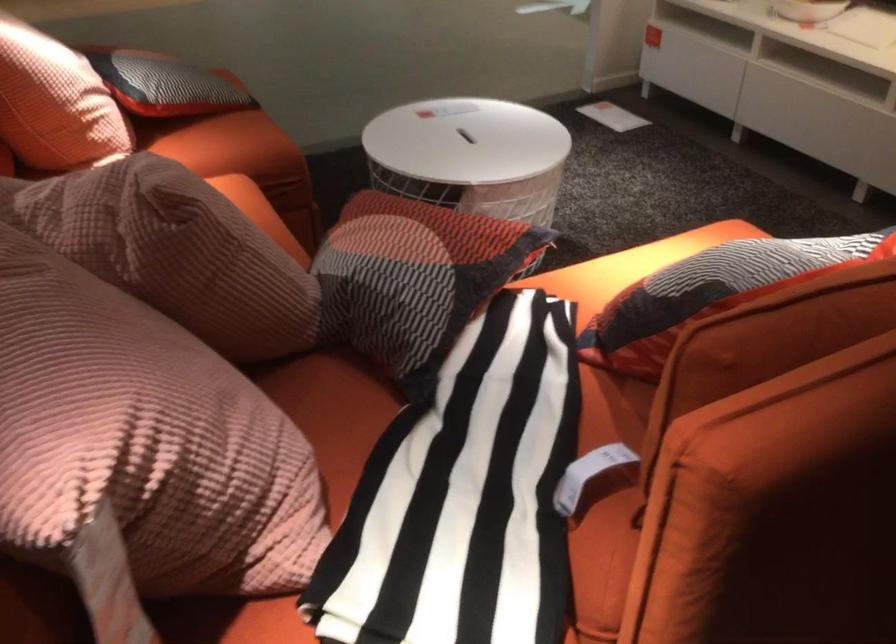
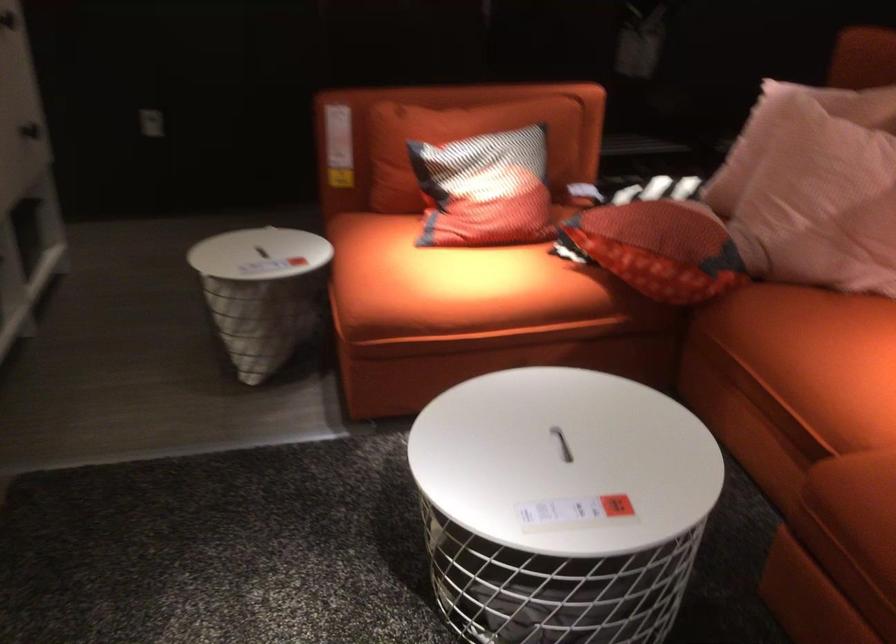
Where in the second image is the point corresponding to the point at 702,257 from the first image?

(485, 190)